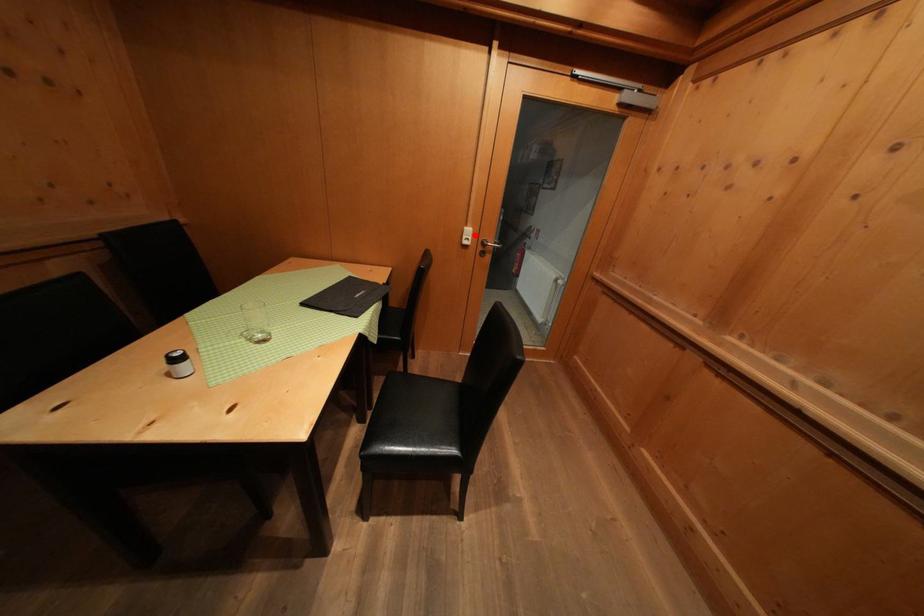
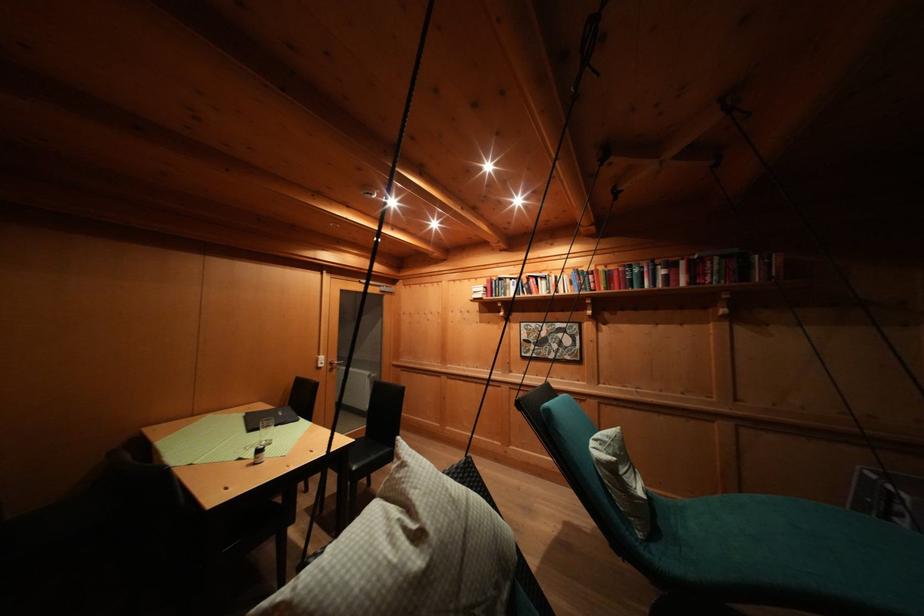
Question: I am providing you with two images of the same scene from different viewpoints. In image1, a red point is highlighted. Considering the same 3D point in image2, which of the following is correct?

Choices:
 (A) It is closer
 (B) It is farther

Answer: (B)